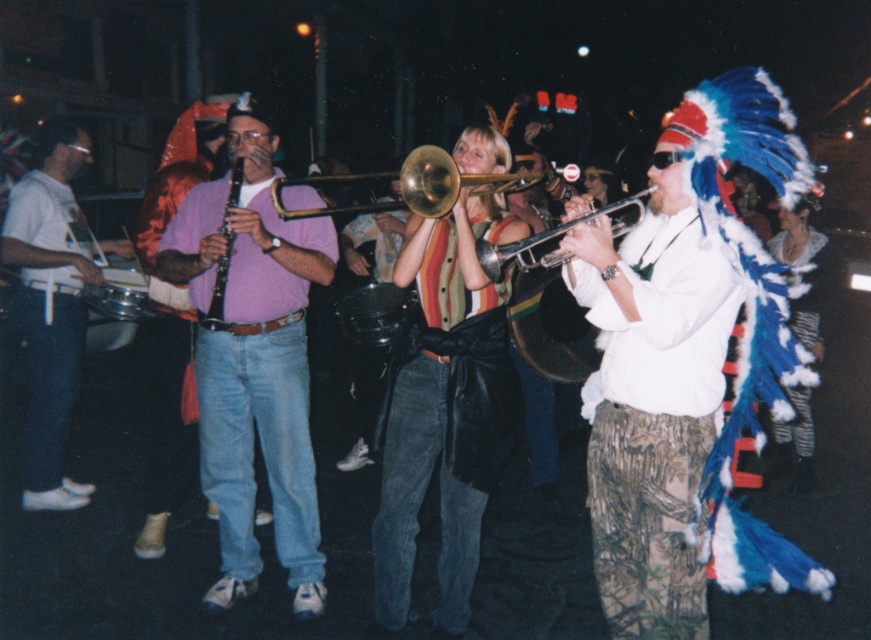
You are a photographer trying to capture a photo of the silver metallic trumpet at center and the white matte shirt at left. Based on their positions, which object should you focus on first if you want to include both in the frame without moving the camera?

The white matte shirt at left is positioned on the left side of the silver metallic trumpet at center, so you should focus on the silver metallic trumpet at center first as it is closer to the center of the frame, allowing both objects to be included without moving the camera.

Based on the coordinates provided, which object is located at point (52, 305)?

The white matte shirt at left is located at point (52, 305).

You are a photographer trying to capture the musician in the pink matte shirt at center. You want to position yourself so that the shiny black drum at center is visible in the background. Is this possible given their positions?

The pink matte shirt at center is located below the shiny black drum at center, so positioning yourself to have the shiny black drum at center in the background while focusing on the pink matte shirt at center is possible as they are vertically aligned.